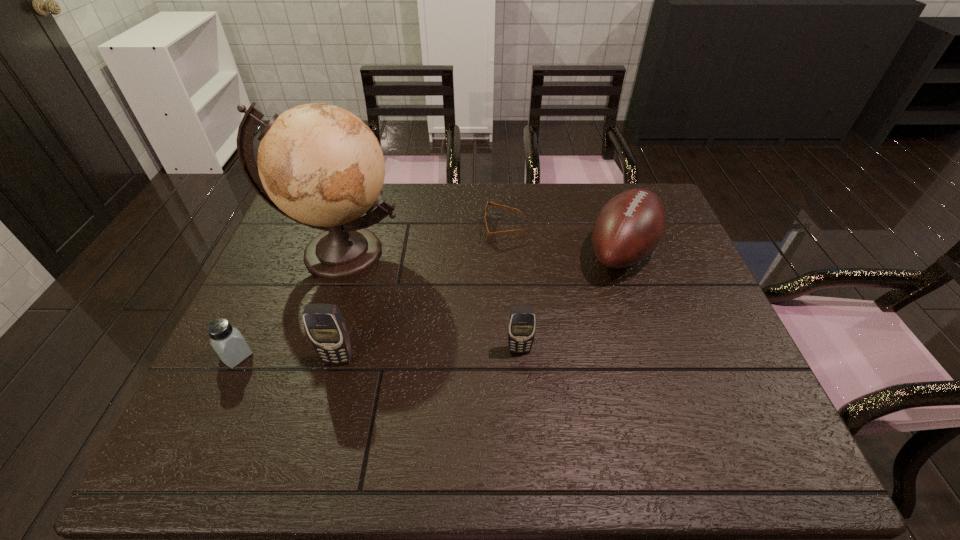
Locate an element on the screen. This screenshot has width=960, height=540. object that is positioned at the right edge is located at coordinates (629, 227).

Locate an element on the screen. This screenshot has width=960, height=540. object at the far left corner is located at coordinates (320, 165).

Image resolution: width=960 pixels, height=540 pixels. I want to click on object at the far right corner, so click(629, 227).

Find the location of a particular element. The image size is (960, 540). vacant area at the far edge of the desktop is located at coordinates (581, 207).

At what (x,y) coordinates should I click in order to perform the action: click on vacant space at the near edge of the desktop. Please return your answer as a coordinate pair (x, y). The width and height of the screenshot is (960, 540). Looking at the image, I should click on point(289,381).

Image resolution: width=960 pixels, height=540 pixels. I want to click on free spot at the left edge of the desktop, so click(x=282, y=327).

At what (x,y) coordinates should I click in order to perform the action: click on blank space at the right edge of the desktop. Please return your answer as a coordinate pair (x, y). Looking at the image, I should click on (673, 343).

In the image, there is a desktop. At what (x,y) coordinates should I click in order to perform the action: click on vacant region at the near left corner. Please return your answer as a coordinate pair (x, y). The image size is (960, 540). Looking at the image, I should click on (228, 388).

The image size is (960, 540). I want to click on vacant space at the near right corner, so click(744, 415).

This screenshot has width=960, height=540. In order to click on vacant area that lies between the football (American) and the shorter cellular telephone in this screenshot , I will do `click(570, 300)`.